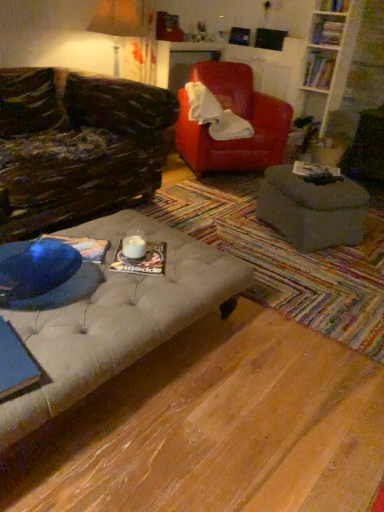
Question: Is hardcover book at center, positioned as the 4th book in top-to-bottom order, wider than matte paper book at center, which appears as the first book when viewed from the front?

Choices:
 (A) yes
 (B) no

Answer: (A)

Question: Can you confirm if hardcover book at center, the fourth book when ordered from back to front, is smaller than matte paper book at center, which is counted as the sixth book, starting from the back?

Choices:
 (A) yes
 (B) no

Answer: (B)

Question: Considering the relative sizes of hardcover book at center, the 3th book ordered from the bottom, and matte paper book at center, the sixth book from the top, in the image provided, is hardcover book at center, the 3th book ordered from the bottom, shorter than matte paper book at center, the sixth book from the top,?

Choices:
 (A) no
 (B) yes

Answer: (A)

Question: Is hardcover book at center, acting as the 4th book starting from the right, not inside matte paper book at center, arranged as the second book when viewed from the left?

Choices:
 (A) no
 (B) yes

Answer: (B)

Question: Is hardcover book at center, acting as the 4th book starting from the right, aimed at matte paper book at center, which appears as the first book when viewed from the front?

Choices:
 (A) no
 (B) yes

Answer: (A)

Question: Considering the relative positions of hardcover book at upper right, marked as the second book in a top-to-bottom arrangement, and matte gray ottoman at center in the image provided, is hardcover book at upper right, marked as the second book in a top-to-bottom arrangement, to the left or to the right of matte gray ottoman at center?

Choices:
 (A) left
 (B) right

Answer: (B)

Question: From the image's perspective, is hardcover book at upper right, which is the fifth book in front-to-back order, located above or below matte gray ottoman at center?

Choices:
 (A) below
 (B) above

Answer: (B)

Question: Would you say hardcover book at upper right, which ranks as the 3th book in right-to-left order, is inside or outside matte gray ottoman at center?

Choices:
 (A) inside
 (B) outside

Answer: (B)

Question: Considering their positions, is hardcover book at upper right, which is the fifth book in front-to-back order, located in front of or behind matte gray ottoman at center?

Choices:
 (A) front
 (B) behind

Answer: (B)

Question: Considering their positions, is matte paper book at center, the 1th book positioned from the bottom, located in front of or behind hardcover book at upper right, which ranks as the fourth book in left-to-right order?

Choices:
 (A) behind
 (B) front

Answer: (B)

Question: From the image's perspective, is matte paper book at center, the 1th book positioned from the bottom, positioned above or below hardcover book at upper right, which ranks as the fourth book in left-to-right order?

Choices:
 (A) below
 (B) above

Answer: (A)

Question: Considering the positions of matte paper book at center, the sixth book from the top, and hardcover book at upper right, which ranks as the fourth book in left-to-right order, in the image, is matte paper book at center, the sixth book from the top, wider or thinner than hardcover book at upper right, which ranks as the fourth book in left-to-right order,?

Choices:
 (A) thin
 (B) wide

Answer: (B)

Question: Is matte paper book at center, arranged as the second book when viewed from the left, taller or shorter than hardcover book at upper right, the fifth book positioned from the bottom?

Choices:
 (A) short
 (B) tall

Answer: (A)

Question: Is point (102, 250) positioned closer to the camera than point (334, 286)?

Choices:
 (A) farther
 (B) closer

Answer: (B)

Question: Is blue paper at center, the 1th book from the left, to the left or to the right of tufted fabric ottoman at center in the image?

Choices:
 (A) right
 (B) left

Answer: (B)